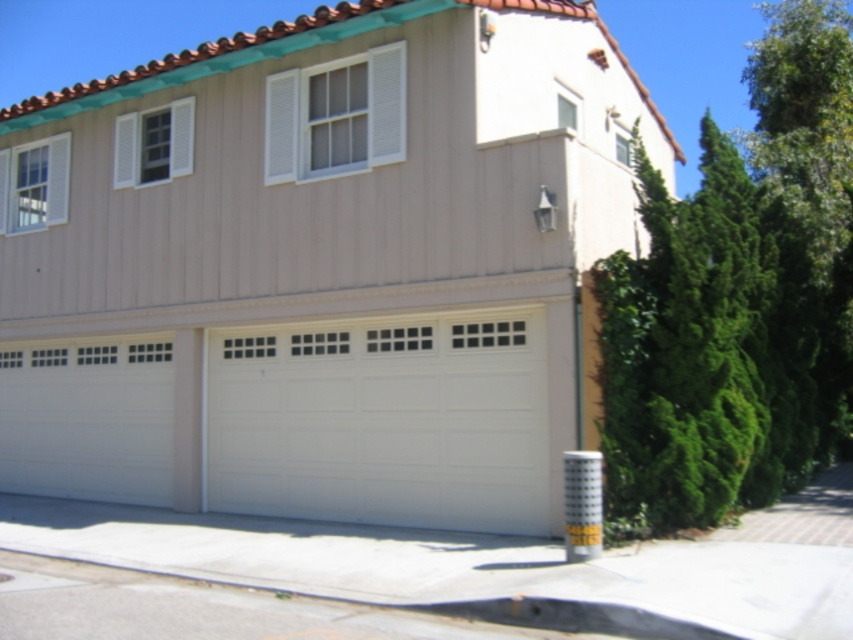
Question: Where is green leafy tree at right located in relation to white painted wood garage door at center in the image?

Choices:
 (A) left
 (B) right

Answer: (B)

Question: Which point is closer to the camera?

Choices:
 (A) white painted wood garage door at center
 (B) white smooth garage door at center
 (C) green leafy tree at right

Answer: (C)

Question: Which of the following is the closest to the observer?

Choices:
 (A) (625, 333)
 (B) (418, 435)

Answer: (A)

Question: Can you confirm if white smooth garage door at center is bigger than white painted wood garage door at center?

Choices:
 (A) yes
 (B) no

Answer: (A)

Question: Does white smooth garage door at center come behind green leafy tree at right?

Choices:
 (A) no
 (B) yes

Answer: (B)

Question: Which of these objects is positioned closest to the green leafy tree at right?

Choices:
 (A) white painted wood garage door at center
 (B) white smooth garage door at center

Answer: (B)